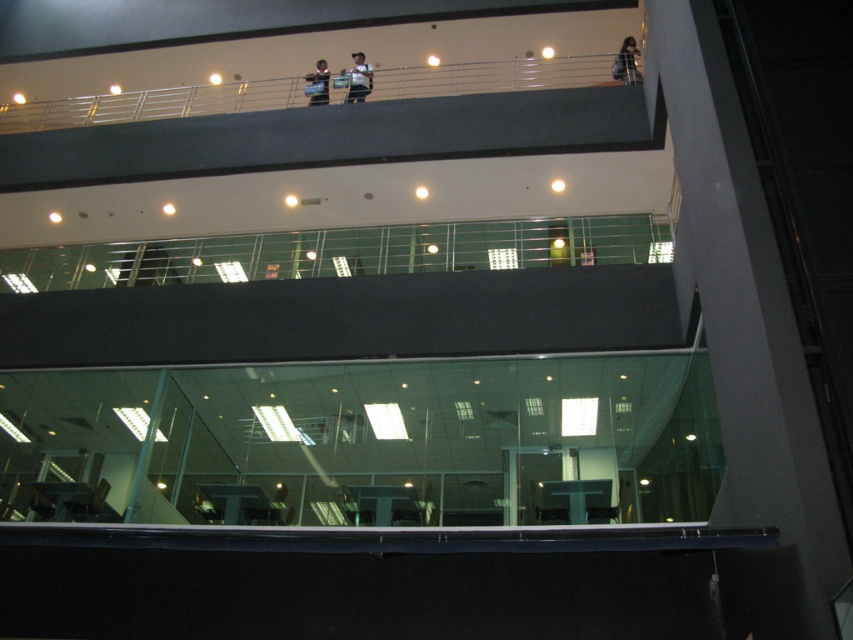
You are a photographer trying to capture a clear shot of the dark hair at upper center and the matte black camera at upper center. Which object appears smaller in your photo?

The dark hair at upper center appears smaller than the matte black camera at upper center in the photo.

You are an interior designer assessing the layout of the building. You notice the dark hair at upper center and the matte black camera at upper center. Which object takes up more horizontal space in the image?

The matte black camera at upper center takes up more horizontal space than the dark hair at upper center because the dark hair at upper center has a lesser width compared to the matte black camera at upper center.